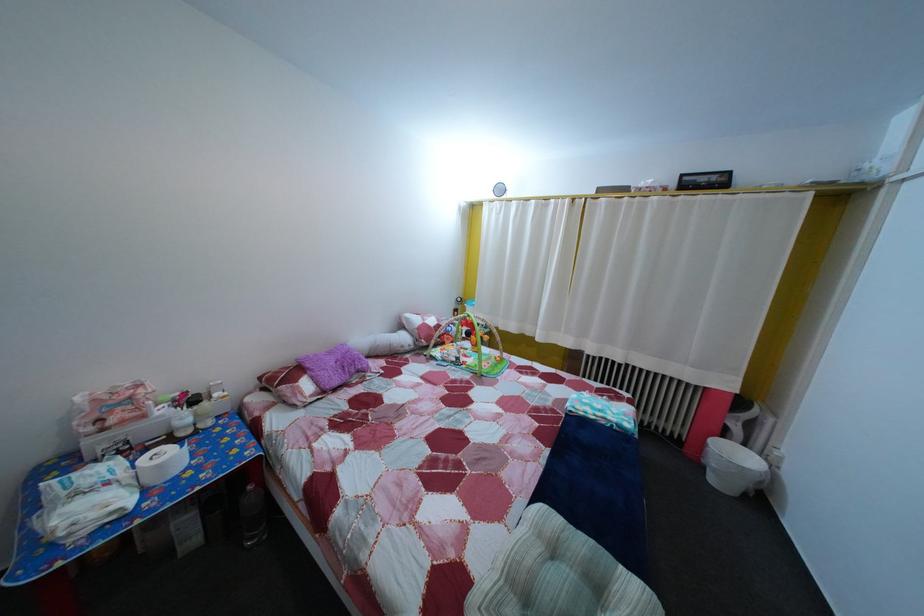
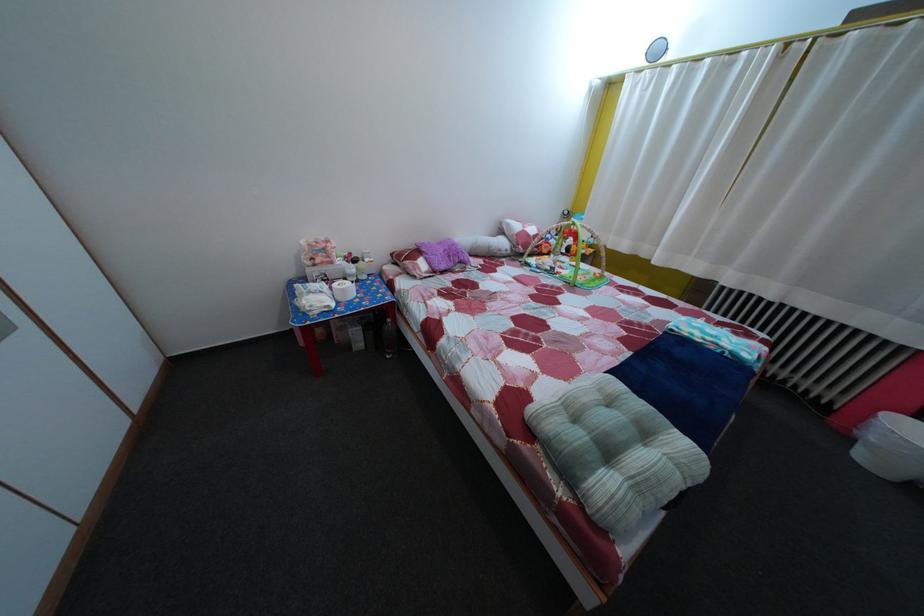
Locate, in the second image, the point that corresponds to [712,476] in the first image.

(860, 447)